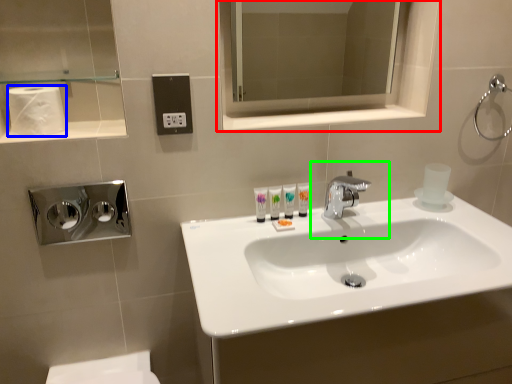
Question: Considering the real-world distances, which object is closest to medicine cabinet (highlighted by a red box)? toilet paper (highlighted by a blue box) or plumbing fixture (highlighted by a green box).

Choices:
 (A) toilet paper
 (B) plumbing fixture

Answer: (B)